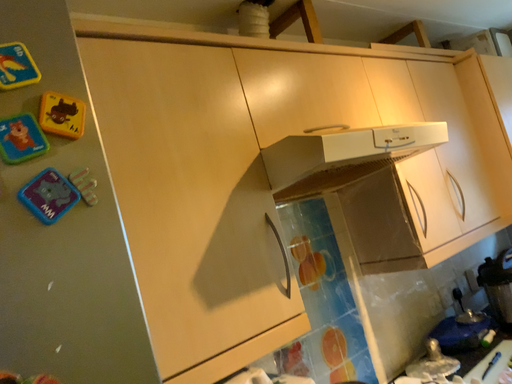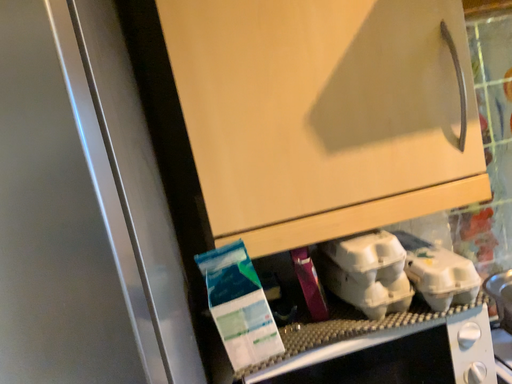
Question: How did the camera likely rotate when shooting the video?

Choices:
 (A) rotated upward
 (B) rotated downward

Answer: (B)